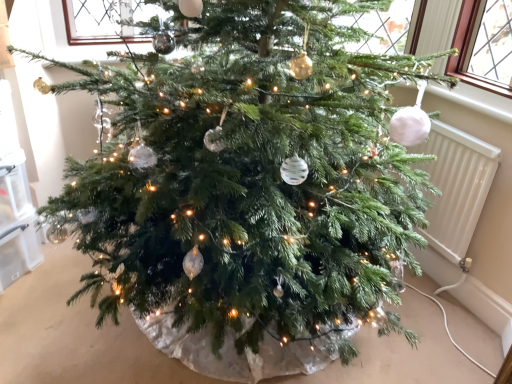
What do you see at coordinates (456, 187) in the screenshot? This screenshot has height=384, width=512. I see `white plastic radiator at right` at bounding box center [456, 187].

At what (x,y) coordinates should I click in order to perform the action: click on white plastic radiator at right. Please return your answer as a coordinate pair (x, y). Looking at the image, I should click on (456, 187).

Measure the distance between white plastic radiator at right and camera.

white plastic radiator at right is 5.52 feet away from camera.

In order to face white plastic radiator at right, should I rotate leftwards or rightwards?

To align with it, rotate right about 23.995°.

You are a GUI agent. You are given a task and a screenshot of the screen. Output one action in this format:
    pyautogui.click(x=<x>, y=<y>)
    Task: Click on the white plastic radiator at right
    The height and width of the screenshot is (384, 512).
    Given the screenshot: What is the action you would take?
    pyautogui.click(x=456, y=187)